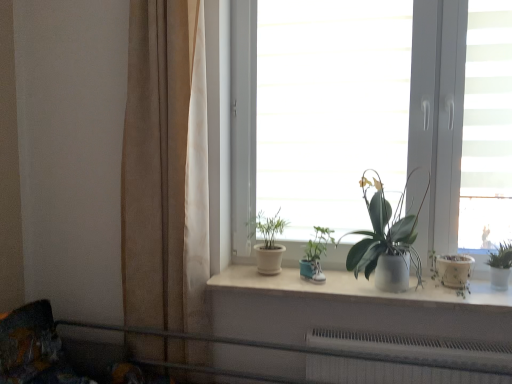
Question: Does matte white pot at center, which ranks as the first houseplant in left-to-right order, have a smaller size compared to burlap curtain at left?

Choices:
 (A) no
 (B) yes

Answer: (B)

Question: Is matte white pot at center, marked as the fourth houseplant in a right-to-left arrangement, to the right of burlap curtain at left from the viewer's perspective?

Choices:
 (A) yes
 (B) no

Answer: (A)

Question: Could you tell me if matte white pot at center, which ranks as the first houseplant in left-to-right order, is turned towards burlap curtain at left?

Choices:
 (A) yes
 (B) no

Answer: (B)

Question: Are matte white pot at center, marked as the fourth houseplant in a right-to-left arrangement, and burlap curtain at left making contact?

Choices:
 (A) yes
 (B) no

Answer: (B)

Question: Considering the relative sizes of matte white pot at center, marked as the fourth houseplant in a right-to-left arrangement, and burlap curtain at left in the image provided, is matte white pot at center, marked as the fourth houseplant in a right-to-left arrangement, bigger than burlap curtain at left?

Choices:
 (A) yes
 (B) no

Answer: (B)

Question: In terms of height, does metallic gray rail at lower center look taller or shorter compared to green matte plant at center, the 2th houseplant viewed from the right?

Choices:
 (A) short
 (B) tall

Answer: (A)

Question: From the image's perspective, is metallic gray rail at lower center above or below green matte plant at center, acting as the 3th houseplant starting from the left?

Choices:
 (A) above
 (B) below

Answer: (B)

Question: Is metallic gray rail at lower center wider or thinner than green matte plant at center, acting as the 3th houseplant starting from the left?

Choices:
 (A) wide
 (B) thin

Answer: (A)

Question: Visually, is metallic gray rail at lower center positioned to the left or to the right of green matte plant at center, the 2th houseplant viewed from the right?

Choices:
 (A) right
 (B) left

Answer: (B)

Question: Is white matte window sill at center taller or shorter than burlap curtain at left?

Choices:
 (A) tall
 (B) short

Answer: (B)

Question: In the image, is white matte window sill at center positioned in front of or behind burlap curtain at left?

Choices:
 (A) front
 (B) behind

Answer: (A)

Question: Is white matte window sill at center wider or thinner than burlap curtain at left?

Choices:
 (A) thin
 (B) wide

Answer: (B)

Question: Based on their positions, is white matte window sill at center located to the left or right of burlap curtain at left?

Choices:
 (A) right
 (B) left

Answer: (A)

Question: Is teal fabric shoe at center, which is the 2th houseplant from left to right, to the left or to the right of metallic gray rail at lower center in the image?

Choices:
 (A) left
 (B) right

Answer: (B)

Question: Considering the positions of point (308, 248) and point (429, 362), is point (308, 248) closer or farther from the camera than point (429, 362)?

Choices:
 (A) farther
 (B) closer

Answer: (A)